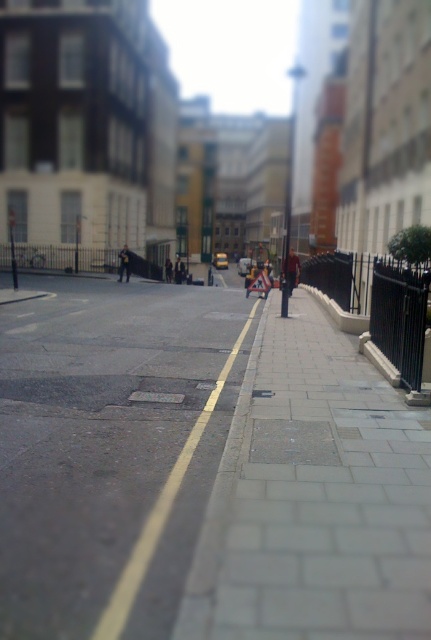
Does gray concrete sidewalk at center have a greater height compared to dark blue jeans at center?

Incorrect, gray concrete sidewalk at center's height is not larger of dark blue jeans at center's.

Does gray concrete sidewalk at center appear on the left side of dark blue jeans at center?

In fact, gray concrete sidewalk at center is to the right of dark blue jeans at center.

Between point (196, 364) and point (122, 262), which one is positioned in front?

Positioned in front is point (196, 364).

Find the location of a particular element. Image resolution: width=431 pixels, height=640 pixels. gray concrete sidewalk at center is located at coordinates (111, 448).

Can you confirm if gray concrete sidewalk at center is smaller than red jacket at center?

Correct, gray concrete sidewalk at center occupies less space than red jacket at center.

Does point (50, 468) lie in front of point (287, 260)?

Yes, point (50, 468) is in front of point (287, 260).

Image resolution: width=431 pixels, height=640 pixels. Identify the location of gray concrete sidewalk at center. (111, 448).

Does paved stone sidewalk at center have a greater width compared to dark blue jeans at center?

Yes.

Does paved stone sidewalk at center appear on the right side of dark blue jeans at center?

Indeed, paved stone sidewalk at center is positioned on the right side of dark blue jeans at center.

Where is `paved stone sidewalk at center`? This screenshot has width=431, height=640. paved stone sidewalk at center is located at coordinates (314, 497).